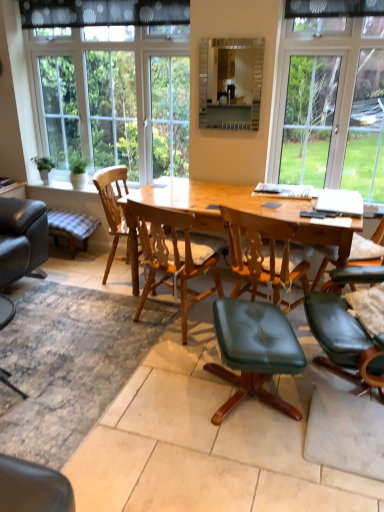
You are a GUI agent. You are given a task and a screenshot of the screen. Output one action in this format:
    pyautogui.click(x=<x>, y=<y>)
    Task: Click on the plaid fabric stool at lower left
    
    Given the screenshot: What is the action you would take?
    pyautogui.click(x=71, y=227)

The image size is (384, 512). Find the location of `wooden table at center`. wooden table at center is located at coordinates (219, 213).

Where is `clear glass window at upper left, the 1th window viewed from the left`? The width and height of the screenshot is (384, 512). clear glass window at upper left, the 1th window viewed from the left is located at coordinates (113, 83).

Which point is more distant from viewer, [106,212] or [173,52]?

The point [173,52] is farther from the camera.

Where is `window that appears on the left of wooden chair at center, acting as the third chair starting from the front`? The height and width of the screenshot is (512, 384). window that appears on the left of wooden chair at center, acting as the third chair starting from the front is located at coordinates (113, 83).

Considering the sizes of wooden chair at center, acting as the third chair starting from the front, and clear glass window at upper left, the 1th window viewed from the left, in the image, is wooden chair at center, acting as the third chair starting from the front, taller or shorter than clear glass window at upper left, the 1th window viewed from the left,?

Clearly, wooden chair at center, acting as the third chair starting from the front, is shorter compared to clear glass window at upper left, the 1th window viewed from the left.

Is green leafy plant at left at the back of black dotted fabric at upper center?

No, black dotted fabric at upper center's orientation is not away from green leafy plant at left.

Can you tell me how much black dotted fabric at upper center and green leafy plant at left differ in facing direction?

black dotted fabric at upper center and green leafy plant at left are facing 2.55 degrees away from each other.

Which is in front, black dotted fabric at upper center or green leafy plant at left?

Positioned in front is black dotted fabric at upper center.

Is black dotted fabric at upper center located outside green leafy plant at left?

A: Indeed, black dotted fabric at upper center is completely outside green leafy plant at left.

Do you think wooden table at center is within matte glass mirror at upper center, or outside of it?

wooden table at center is outside matte glass mirror at upper center.

Looking at this image, who is smaller, wooden table at center or matte glass mirror at upper center?

matte glass mirror at upper center is smaller.

Looking at this image, are wooden table at center and matte glass mirror at upper center beside each other?

wooden table at center and matte glass mirror at upper center are clearly separated.

This screenshot has width=384, height=512. In order to click on mirror located on the left of wooden table at center in this screenshot , I will do `click(230, 83)`.

Is plaid fabric stool at lower left to the left of black dotted fabric at upper center from the viewer's perspective?

Correct, you'll find plaid fabric stool at lower left to the left of black dotted fabric at upper center.

Does plaid fabric stool at lower left turn towards black dotted fabric at upper center?

No.

Is point (89, 231) in front of point (35, 20)?

No, it is behind (35, 20).

Are wooden chair at center, acting as the third chair starting from the front, and green leather stool at center, which is counted as the third chair, starting from the back, beside each other?

No, wooden chair at center, acting as the third chair starting from the front, is not with green leather stool at center, which is counted as the third chair, starting from the back.

How far apart are wooden chair at center, which is the 1th chair in back-to-front order, and green leather stool at center, the 1th chair when ordered from front to back?

The distance of wooden chair at center, which is the 1th chair in back-to-front order, from green leather stool at center, the 1th chair when ordered from front to back, is 4.85 feet.

Does wooden chair at center, acting as the third chair starting from the front, have a smaller size compared to green leather stool at center, which is counted as the third chair, starting from the back?

No, wooden chair at center, acting as the third chair starting from the front, is not smaller than green leather stool at center, which is counted as the third chair, starting from the back.

Is wooden chair at center, which is the 1th chair in back-to-front order, wider or thinner than green leather stool at center, which is counted as the third chair, starting from the back?

wooden chair at center, which is the 1th chair in back-to-front order, is wider than green leather stool at center, which is counted as the third chair, starting from the back.

Would you say matte glass mirror at upper center is to the left or to the right of wooden table at center in the picture?

Based on their positions, matte glass mirror at upper center is located to the left of wooden table at center.

From a real-world perspective, is matte glass mirror at upper center positioned under wooden table at center based on gravity?

No, from a real-world perspective, matte glass mirror at upper center is not under wooden table at center.

Looking at their sizes, would you say matte glass mirror at upper center is wider or thinner than wooden table at center?

In the image, matte glass mirror at upper center appears to be more narrow than wooden table at center.

From the picture: Measure the distance between green leather stool at center, the 1th chair when ordered from front to back, and clear glass window at upper right, which is the 2th window from left to right.

green leather stool at center, the 1th chair when ordered from front to back, and clear glass window at upper right, which is the 2th window from left to right, are 1.68 meters apart.

Which is nearer, (x=273, y=329) or (x=271, y=138)?

Positioned in front is point (x=273, y=329).

Is green leather stool at center, which is counted as the third chair, starting from the back, located outside clear glass window at upper right, which is the 2th window from left to right?

That's correct, green leather stool at center, which is counted as the third chair, starting from the back, is outside of clear glass window at upper right, which is the 2th window from left to right.

This screenshot has height=512, width=384. Identify the location of the 1st chair in front of the clear glass window at upper left, the 1th window viewed from the left. (112, 207).

This screenshot has height=512, width=384. What are the coordinates of `houseplant that appears behind the black dotted fabric at upper center` in the screenshot? It's located at (44, 168).

When comparing their distances from wooden table at center, does black dotted fabric at upper center or green leather stool at center, the 1th chair when ordered from front to back, seem further?

black dotted fabric at upper center is positioned further to the anchor wooden table at center.

Looking at the image, which one is located closer to matte glass mirror at upper center, wooden table at center or black plastic remote control at center?

wooden table at center is closer to matte glass mirror at upper center.

When comparing their distances from clear glass window at upper right, which is the 2th window from left to right, does clear glass window at upper left, the 1th window viewed from the left, or black dotted fabric at upper center seem closer?

clear glass window at upper left, the 1th window viewed from the left.

Which object lies further to the anchor point green leafy plant at left, clear glass window at upper left, the 1th window viewed from the left, or plaid fabric stool at lower left?

clear glass window at upper left, the 1th window viewed from the left, lies further to green leafy plant at left than the other object.

Based on their spatial positions, is plaid fabric stool at lower left or green leafy plant at left further from clear glass window at upper left, the 1th window viewed from the left?

Based on the image, plaid fabric stool at lower left appears to be further to clear glass window at upper left, the 1th window viewed from the left.

From the image, which object appears to be farther from clear glass window at upper left, the 1th window viewed from the left, green leather stool at center, which is counted as the third chair, starting from the back, or wooden chair at center, which is the 2th chair from front to back?

Among the two, green leather stool at center, which is counted as the third chair, starting from the back, is located further to clear glass window at upper left, the 1th window viewed from the left.

From the image, which object appears to be farther from wooden chair at center, acting as the third chair starting from the front, matte glass mirror at upper center or wooden chair at center, which is the second chair in back-to-front order?

matte glass mirror at upper center lies further to wooden chair at center, acting as the third chair starting from the front, than the other object.

From the image, which object appears to be farther from clear glass window at upper right, which is the 2th window from left to right, wooden chair at center, which is the 2th chair from front to back, or green leafy plant at left?

The object further to clear glass window at upper right, which is the 2th window from left to right, is green leafy plant at left.

Find the location of a particular element. The width and height of the screenshot is (384, 512). stool between wooden chair at center, which is the second chair in back-to-front order, and green leafy plant at left, along the z-axis is located at coordinates (71, 227).

Identify the location of remote control located between plaid fabric stool at lower left and clear glass window at upper right, which ranks as the first window in right-to-left order, in the left-right direction. This screenshot has width=384, height=512. (317, 214).

Find the location of a particular element. The height and width of the screenshot is (512, 384). desk between clear glass window at upper left, the 1th window viewed from the left, and clear glass window at upper right, which ranks as the first window in right-to-left order, from left to right is located at coordinates (219, 213).

The width and height of the screenshot is (384, 512). Identify the location of desk situated between wooden chair at center, acting as the third chair starting from the front, and clear glass window at upper right, which ranks as the first window in right-to-left order, from left to right. (219, 213).